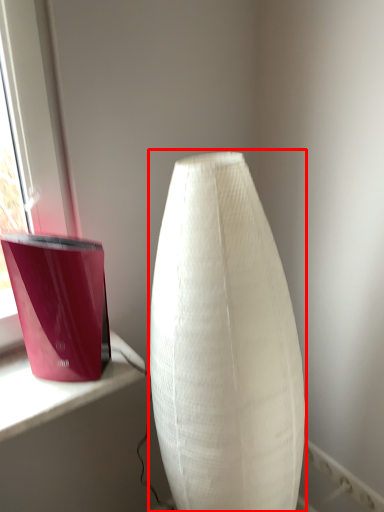
Question: Considering the relative positions of lamp (annotated by the red box) and candle holder in the image provided, where is lamp (annotated by the red box) located with respect to the staircase?

Choices:
 (A) left
 (B) right

Answer: (B)